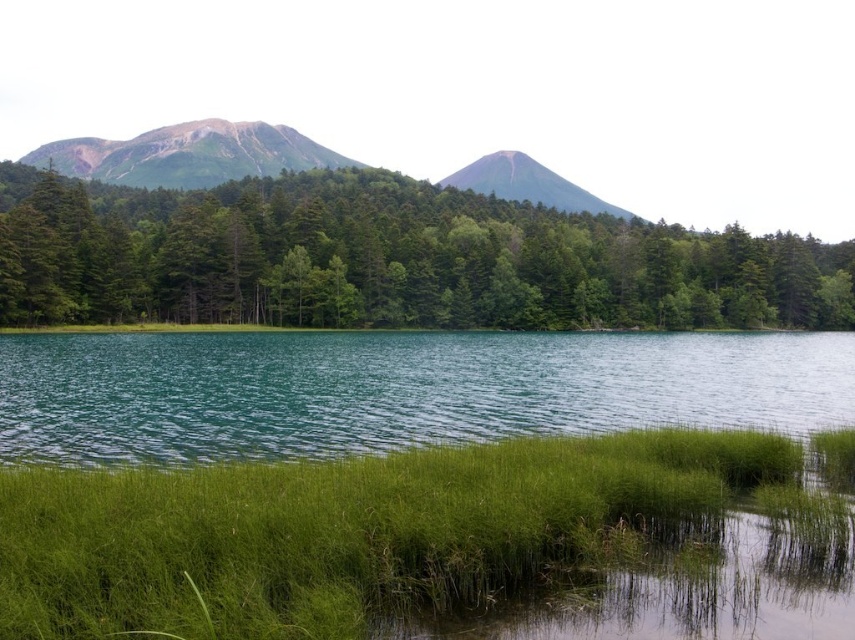
Question: Does green soft grass at lower center appear over smooth gray mountain at center?

Choices:
 (A) yes
 (B) no

Answer: (B)

Question: Which of these objects is positioned closest to the teal glossy water at center?

Choices:
 (A) smooth gray mountain at center
 (B) green matte tree at center

Answer: (B)

Question: From the image, what is the correct spatial relationship of green matte tree at center in relation to teal glossy water at center?

Choices:
 (A) left
 (B) right

Answer: (A)

Question: Which object is positioned farthest from the teal glossy water at center?

Choices:
 (A) green matte tree at center
 (B) rugged granite mountain at upper left

Answer: (B)

Question: Which point is closer to the camera taking this photo?

Choices:
 (A) (97, 262)
 (B) (275, 346)
 (C) (276, 157)

Answer: (B)

Question: Can you confirm if green matte tree at center is thinner than smooth gray mountain at center?

Choices:
 (A) yes
 (B) no

Answer: (B)